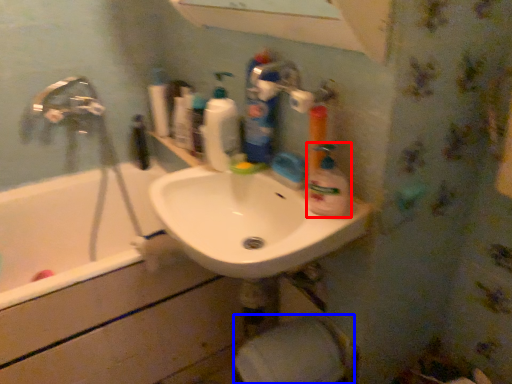
Question: Which point is closer to the camera, cleaning product (highlighted by a red box) or toilet paper (highlighted by a blue box)?

Choices:
 (A) cleaning product
 (B) toilet paper

Answer: (A)